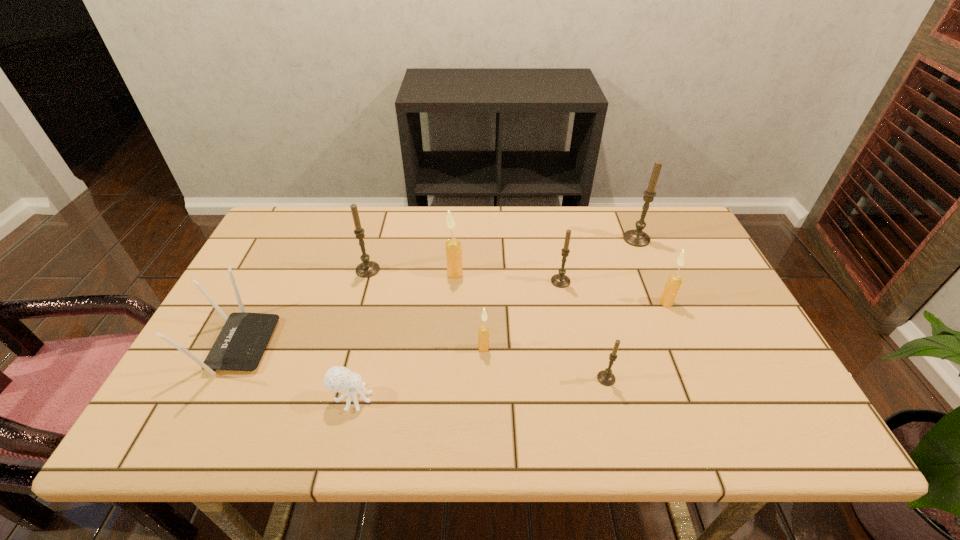
What are the coordinates of `the farthest object` in the screenshot? It's located at (638, 238).

You are a GUI agent. You are given a task and a screenshot of the screen. Output one action in this format:
    pyautogui.click(x=<x>, y=<y>)
    Task: Click on the rightmost gray candle
    
    Given the screenshot: What is the action you would take?
    pyautogui.click(x=638, y=238)

Identify the location of the sixth candle from right to left. (453, 246).

This screenshot has height=540, width=960. In order to click on the biggest cream candle in this screenshot , I will do `click(453, 246)`.

Image resolution: width=960 pixels, height=540 pixels. Identify the location of the leftmost candle. (367, 268).

Locate an element on the screen. Image resolution: width=960 pixels, height=540 pixels. the leftmost gray candle is located at coordinates (367, 268).

Find the location of a particular element. The width and height of the screenshot is (960, 540). the rightmost cream candle is located at coordinates (674, 281).

Where is `the second nearest cream candle`? The height and width of the screenshot is (540, 960). the second nearest cream candle is located at coordinates (674, 281).

You are a GUI agent. You are given a task and a screenshot of the screen. Output one action in this format:
    pyautogui.click(x=<x>, y=<y>)
    Task: Click on the fourth object from right to left
    This screenshot has width=960, height=540.
    Given the screenshot: What is the action you would take?
    pyautogui.click(x=560, y=280)

This screenshot has width=960, height=540. What are the coordinates of `the second gray candle from left to right` in the screenshot? It's located at (560, 280).